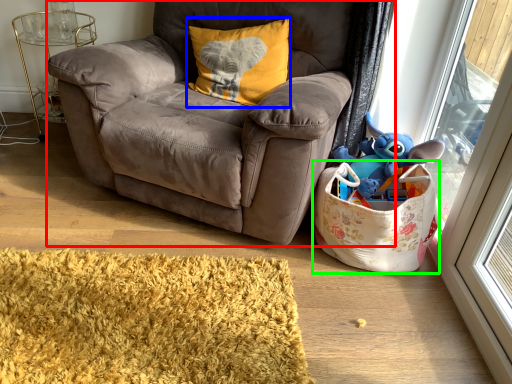
Question: Which object is the farthest from chair (highlighted by a red box)? Choose among these: pillow (highlighted by a blue box) or bag (highlighted by a green box).

Choices:
 (A) pillow
 (B) bag

Answer: (B)